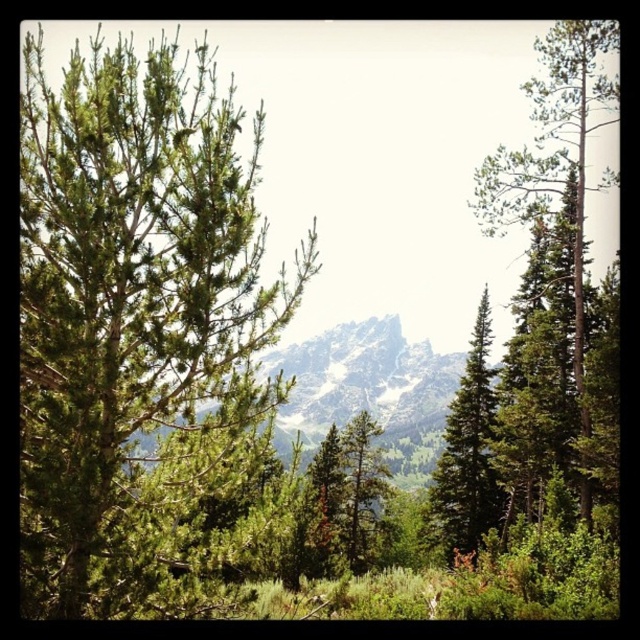
Question: Can you confirm if green textured pine tree at right is wider than green needle-like tree at center?

Choices:
 (A) yes
 (B) no

Answer: (A)

Question: Which object is the closest to the green needle-like at left?

Choices:
 (A) green matte tree at center
 (B) green textured pine tree at right
 (C) green needle-like tree at center
 (D) green textured mountain at center

Answer: (C)

Question: Does green needle-like at left appear on the right side of green matte tree at center?

Choices:
 (A) yes
 (B) no

Answer: (B)

Question: Is green textured mountain at center smaller than green matte tree at center?

Choices:
 (A) no
 (B) yes

Answer: (A)

Question: Which point appears closest to the camera in this image?

Choices:
 (A) (362, 419)
 (B) (52, 301)
 (C) (362, 355)

Answer: (B)

Question: Which object is farther from the camera taking this photo?

Choices:
 (A) green needle-like at left
 (B) green needle-like tree at center
 (C) green matte tree at center
 (D) green textured pine tree at right

Answer: (C)